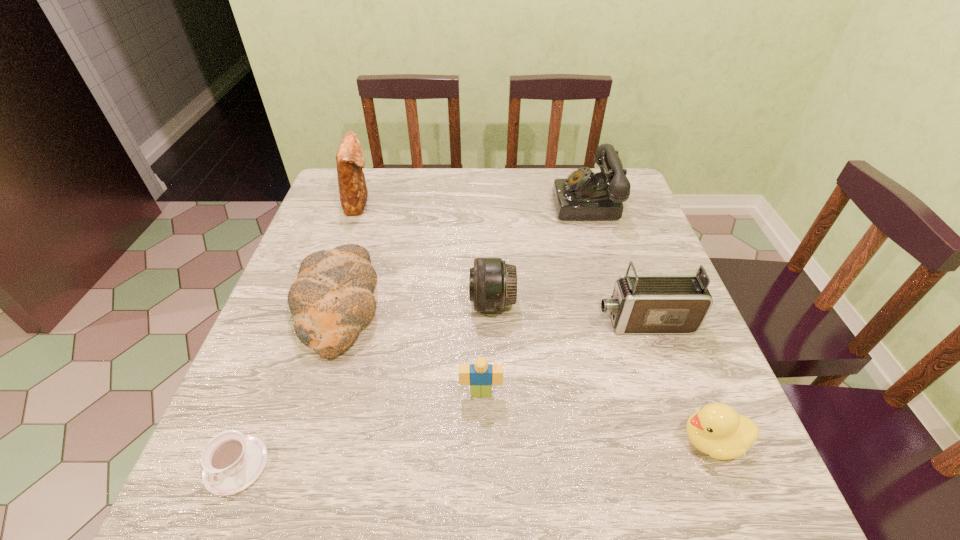
Where is `vacant space at the right edge of the desktop`? The image size is (960, 540). vacant space at the right edge of the desktop is located at coordinates (751, 451).

This screenshot has width=960, height=540. In order to click on free space at the near right corner of the desktop in this screenshot , I will do `click(737, 472)`.

At what (x,y) coordinates should I click in order to perform the action: click on free space between the bread and the camcorder. Please return your answer as a coordinate pair (x, y). The width and height of the screenshot is (960, 540). Looking at the image, I should click on (492, 314).

You are a GUI agent. You are given a task and a screenshot of the screen. Output one action in this format:
    pyautogui.click(x=<x>, y=<y>)
    Task: Click on the vacant space in between the clutch bag and the telephone
    
    Given the screenshot: What is the action you would take?
    pyautogui.click(x=474, y=202)

Identify the location of empty location between the telephone and the teacup. click(413, 334).

Identify the location of empty space that is in between the clutch bag and the Lego. This screenshot has height=540, width=960. (420, 298).

The width and height of the screenshot is (960, 540). In order to click on empty space that is in between the duckling and the bread in this screenshot , I will do `click(526, 373)`.

At what (x,y) coordinates should I click in order to perform the action: click on free space that is in between the teacup and the camcorder. Please return your answer as a coordinate pair (x, y). Looking at the image, I should click on (440, 394).

Where is `empty location between the telephoto lens and the telephone`? Image resolution: width=960 pixels, height=540 pixels. empty location between the telephoto lens and the telephone is located at coordinates (540, 253).

You are a GUI agent. You are given a task and a screenshot of the screen. Output one action in this format:
    pyautogui.click(x=<x>, y=<y>)
    Task: Click on the empty location between the shortest object and the third nearest object
    
    Given the screenshot: What is the action you would take?
    pyautogui.click(x=359, y=429)